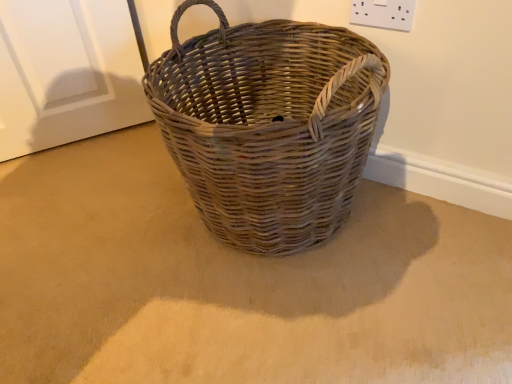
I want to click on vacant area that lies in front of natural woven picnic basket at center, so click(284, 326).